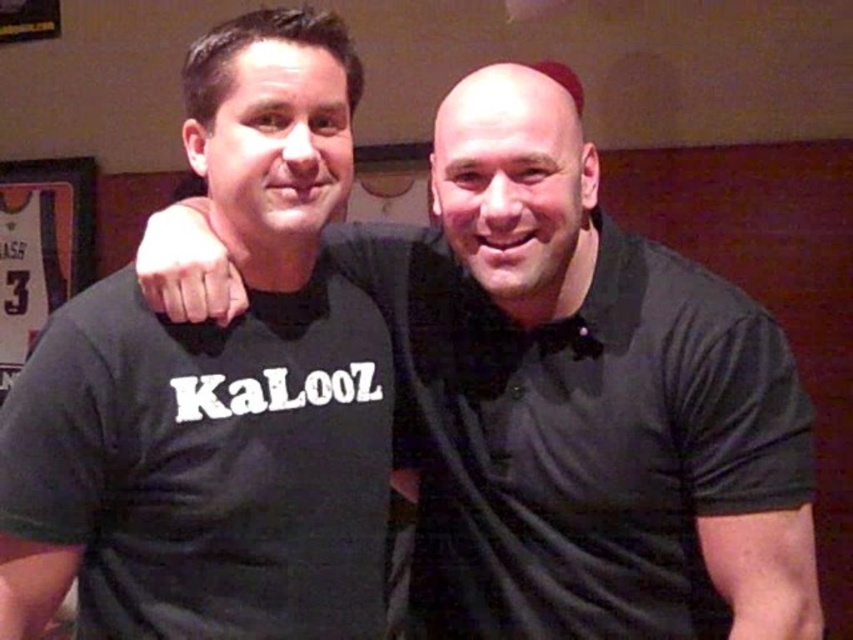
Looking at this image, you are a fashion designer trying to create a new line of clothing. You want to ensure that the shirts you design will look good when worn by people standing close together. You see two shirts in the image, the black matte shirt at center and the black cotton polo shirt at right. Which shirt has a longer length when worn?

The black matte shirt at center is much taller than the black cotton polo shirt at right, so the black matte shirt at center has a longer length when worn.

You are a photographer standing 3 feet away from the black matte shirt at center. Can you take a clear photo of it without moving closer?

The black matte shirt at center is 33.75 inches away from the viewer. Since 3 feet equals 36 inches, you are actually 2.25 inches further away than the shirt. Therefore, you can take a clear photo without moving closer as you are already within the required distance.